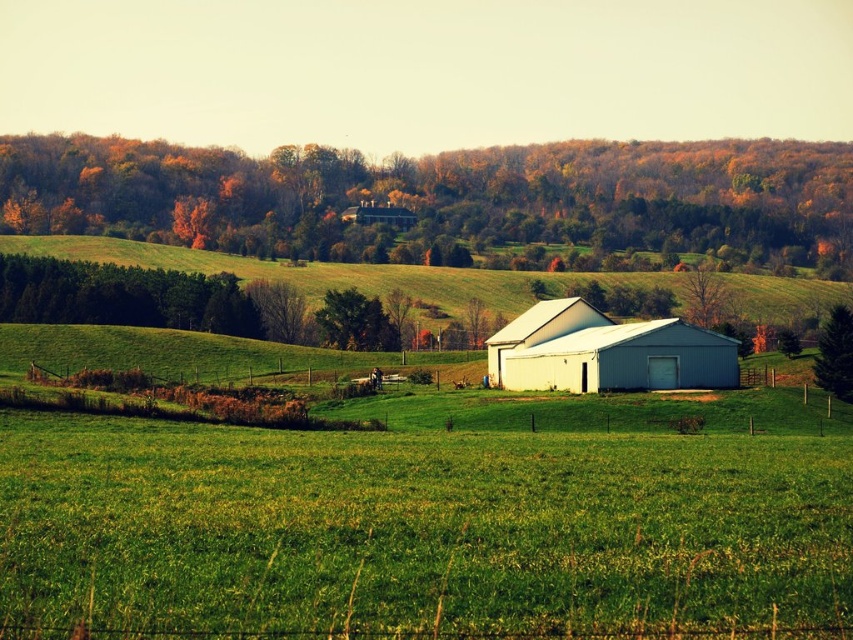
Question: From the image, what is the correct spatial relationship of green grassy hillside at center in relation to green leafy tree at center?

Choices:
 (A) below
 (B) above

Answer: (B)

Question: Which of the following is the farthest from the observer?

Choices:
 (A) (811, 365)
 (B) (357, 205)
 (C) (393, 336)

Answer: (B)

Question: Which point is closer to the camera?

Choices:
 (A) green grassy hillside at center
 (B) white matte barn at upper center
 (C) white matte barn at center

Answer: (C)

Question: Does autumn leaves at upper center come in front of green leafy tree at center?

Choices:
 (A) no
 (B) yes

Answer: (A)

Question: Can you confirm if white matte barn at center is positioned below green matte tree at right?

Choices:
 (A) no
 (B) yes

Answer: (B)

Question: Among these points, which one is nearest to the camera?

Choices:
 (A) tap(370, 211)
 (B) tap(563, 321)
 (C) tap(96, 140)
 (D) tap(360, 333)

Answer: (B)